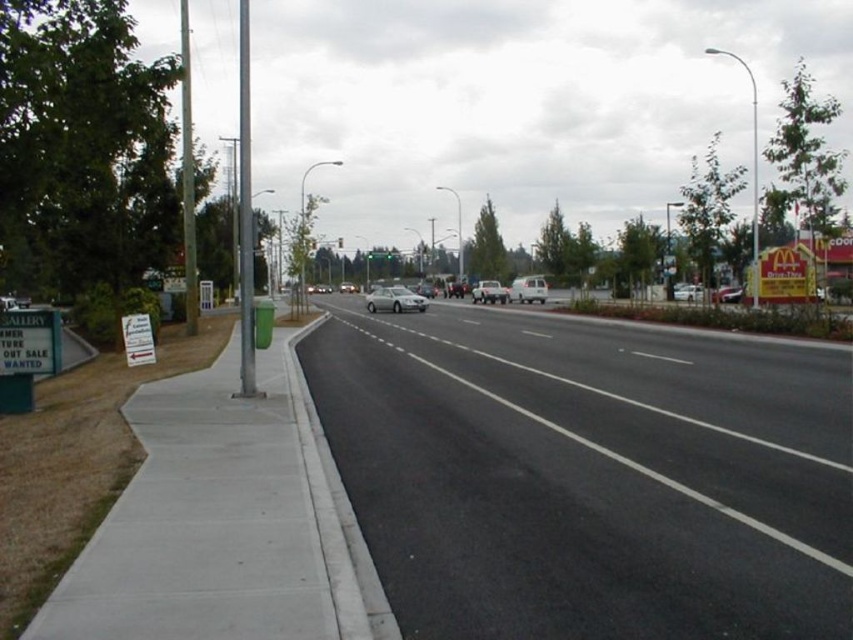
Question: Which point appears farthest from the camera in this image?

Choices:
 (A) (190, 301)
 (B) (490, 282)
 (C) (543, 282)
 (D) (474, 518)

Answer: (B)

Question: Does black asphalt highway at center have a lesser width compared to silver metallic pole at left?

Choices:
 (A) no
 (B) yes

Answer: (B)

Question: Among these points, which one is farthest from the camera?

Choices:
 (A) (444, 611)
 (B) (532, 300)
 (C) (55, 369)
 (D) (244, 390)

Answer: (B)

Question: Is silver metallic pole at left wider than white matte van at center?

Choices:
 (A) no
 (B) yes

Answer: (B)

Question: Observing the image, what is the correct spatial positioning of gray concrete curb at lower left in reference to white paper sign at lower left?

Choices:
 (A) left
 (B) right

Answer: (B)

Question: Among these points, which one is farthest from the camera?

Choices:
 (A) click(805, 496)
 (B) click(247, 365)
 (C) click(531, 289)

Answer: (C)